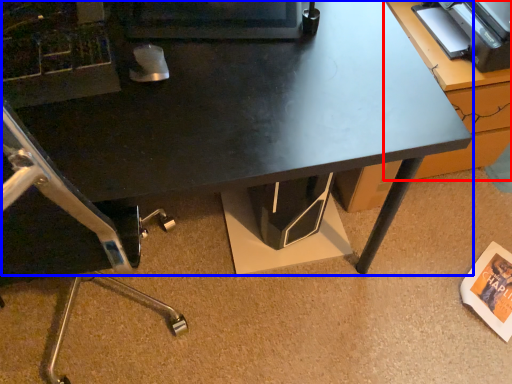
Question: Which of the following is the farthest to the observer, table (highlighted by a red box) or desk (highlighted by a blue box)?

Choices:
 (A) table
 (B) desk

Answer: (A)